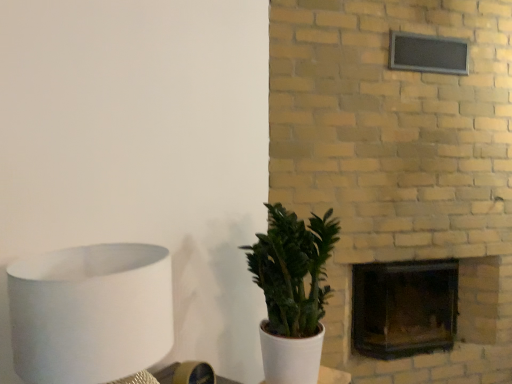
Question: Considering the relative positions of green matte plant at center and white matte lampshade at left in the image provided, is green matte plant at center to the left or to the right of white matte lampshade at left?

Choices:
 (A) right
 (B) left

Answer: (A)

Question: Is green matte plant at center taller or shorter than white matte lampshade at left?

Choices:
 (A) short
 (B) tall

Answer: (B)

Question: Estimate the real-world distances between objects in this image. Which object is farther from the black glass fireplace at center-right?

Choices:
 (A) white matte lampshade at left
 (B) green matte plant at center

Answer: (A)

Question: Estimate the real-world distances between objects in this image. Which object is farther from the green matte plant at center?

Choices:
 (A) black glass fireplace at center-right
 (B) white matte lampshade at left

Answer: (A)